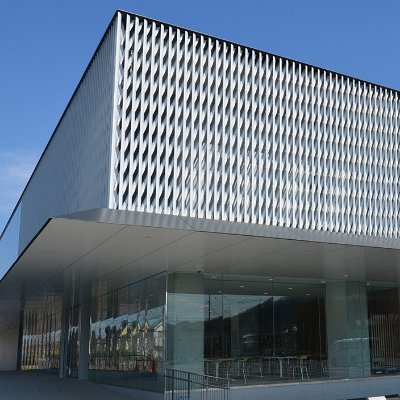
Identify the location of tables. Image resolution: width=400 pixels, height=400 pixels. point(230,357), point(280,356).